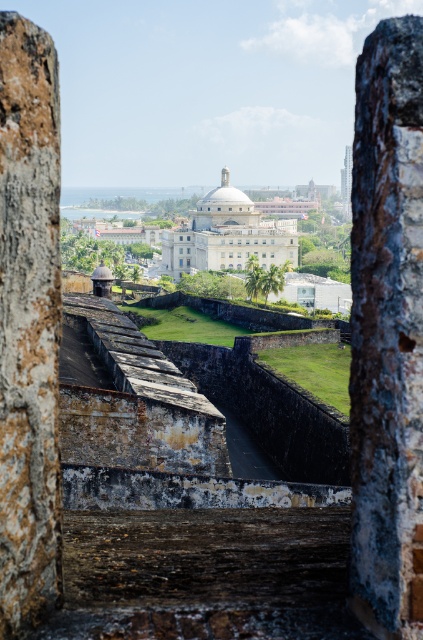
Question: Which point is farther from the camera taking this photo?

Choices:
 (A) [345, 180]
 (B) [178, 248]
 (C) [181, 260]

Answer: (A)

Question: Which of the following is the closest to the observer?

Choices:
 (A) transparent glass window at center
 (B) smooth concrete tower at center

Answer: (A)

Question: Where is smooth concrete tower at center located in relation to white glass window at center in the image?

Choices:
 (A) above
 (B) below

Answer: (A)

Question: Does white smooth building at center appear over transparent glass window at center?

Choices:
 (A) no
 (B) yes

Answer: (B)

Question: Is white smooth building at center positioned behind transparent glass window at center?

Choices:
 (A) no
 (B) yes

Answer: (A)

Question: Which object appears closest to the camera in this image?

Choices:
 (A) smooth concrete tower at center
 (B) transparent glass window at center
 (C) white smooth building at center

Answer: (C)